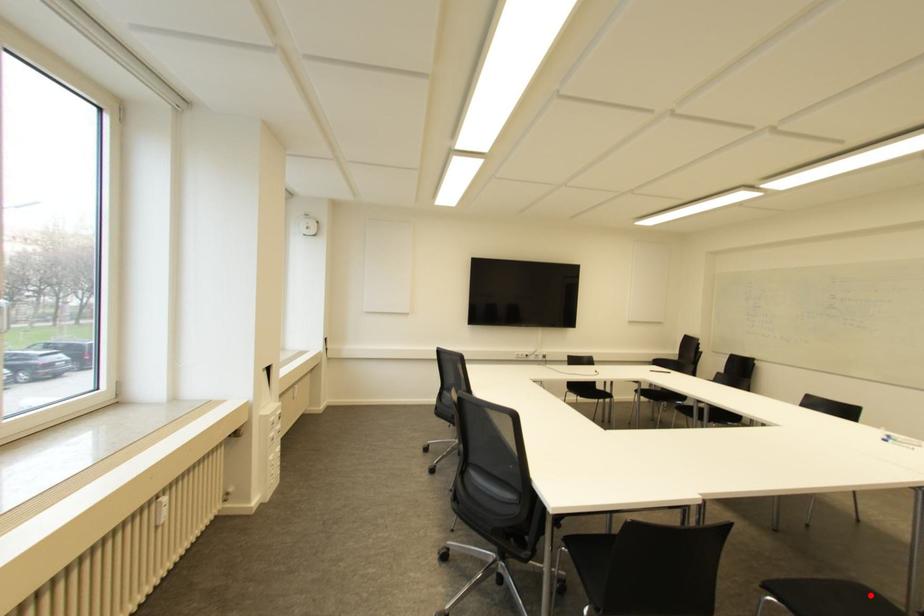
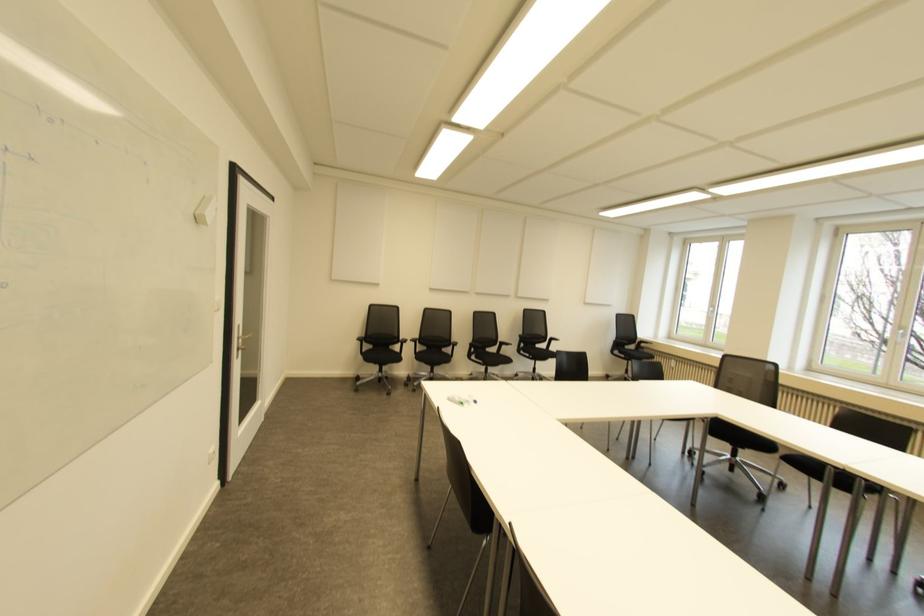
Question: I am providing you with two images of the same scene from different viewpoints. A red point is marked on the first image. Can you still see the location of the red point in image 2?

Choices:
 (A) Yes
 (B) No

Answer: (B)